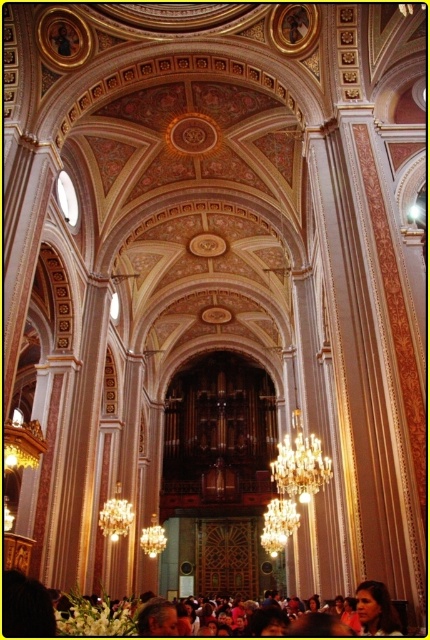
You are standing in the center of the church and want to walk directly towards the gold crystal chandelier at center. Which direction should you walk?

Since the gold crystal chandelier at center is located at point (300, 464) in 2D coordinates, you should walk forward towards it as it is directly ahead of your current position at the center.

You are standing in the grand cathedral and want to take a photo of the smooth skin face at lower right without the gold crystal chandelier at center blocking the view. Is this possible?

The smooth skin face at lower right is behind the gold crystal chandelier at center, so it is currently blocked by the chandelier. To take a clear photo of the smooth skin face at lower right without obstruction, you would need to move to a position where the chandelier is no longer in front of the face.

You are standing in the grand cathedral and want to take a photo of the gold crystal chandelier at center and the smooth skin face at lower right. Which object should you adjust your camera to focus on first if you want both in the frame without moving the camera?

The gold crystal chandelier at center is positioned on the right side of smooth skin face at lower right, so you should focus on the smooth skin face at lower right first to ensure both are in the frame.